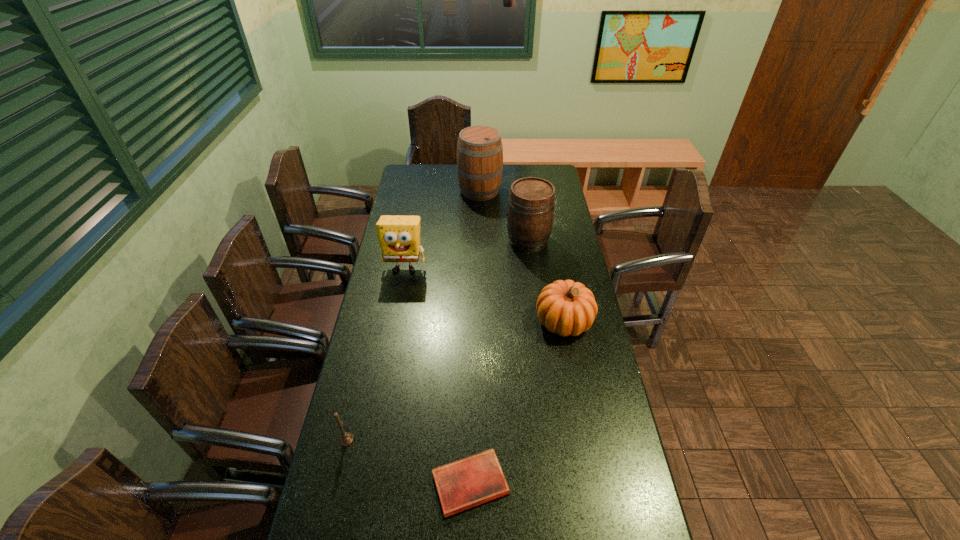
Find the location of a particular element. the shortest object is located at coordinates (471, 481).

Locate an element on the screen. blank space located on the right of the farther cider is located at coordinates (534, 191).

Identify the location of free space located on the side of the nearer cider near the bung hole. Image resolution: width=960 pixels, height=540 pixels. (417, 241).

Image resolution: width=960 pixels, height=540 pixels. What are the coordinates of `free space located 0.310m on the side of the nearer cider near the bung hole` in the screenshot? It's located at (435, 241).

Identify the location of vacant space located on the side of the nearer cider near the bung hole. (448, 241).

Find the location of `free space located 0.120m on the face of the fourth nearest object`. free space located 0.120m on the face of the fourth nearest object is located at coordinates 398,301.

This screenshot has width=960, height=540. I want to click on vacant space located 0.240m on the left of the third nearest object, so click(468, 321).

This screenshot has width=960, height=540. I want to click on vacant space located 0.190m on the right of the candle, so click(x=420, y=440).

Where is `vacant space located 0.090m on the back of the shortest object`? vacant space located 0.090m on the back of the shortest object is located at coordinates 471,422.

Identify the location of object that is at the far edge. (479, 148).